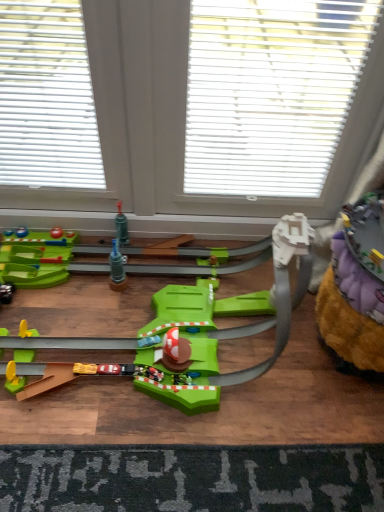
Question: Is white plastic blinds at upper center bigger or smaller than dark gray textured mat at lower center?

Choices:
 (A) big
 (B) small

Answer: (A)

Question: Considering the positions of white plastic blinds at upper center and dark gray textured mat at lower center in the image, is white plastic blinds at upper center taller or shorter than dark gray textured mat at lower center?

Choices:
 (A) tall
 (B) short

Answer: (A)

Question: Based on their relative distances, which object is nearer to the dark gray textured mat at lower center?

Choices:
 (A) white plastic window at center
 (B) fuzzy yellow carpet at lower right, the 2th toy viewed from the left
 (C) white plastic blinds at upper center
 (D) green plastic track at center, the 2th toy viewed from the right

Answer: (D)

Question: Estimate the real-world distances between objects in this image. Which object is closer to the white plastic blinds at upper center?

Choices:
 (A) green plastic track at center, the 2th toy viewed from the right
 (B) dark gray textured mat at lower center
 (C) fuzzy yellow carpet at lower right, the 2th toy viewed from the left
 (D) white plastic window at center

Answer: (D)